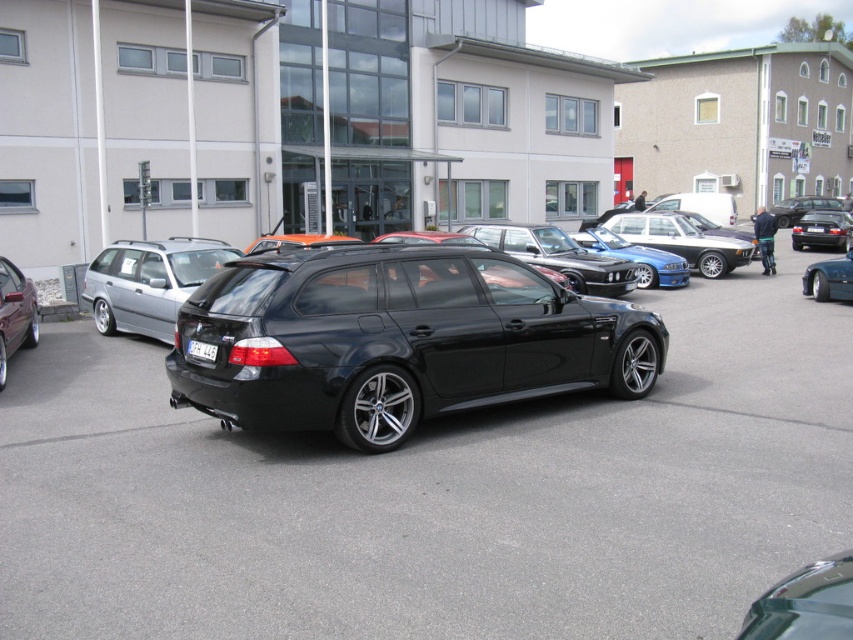
You are a parking attendant and need to direct a driver to park their car. You see the silver metallic station wagon at left and the white plastic license plate at center. Which object is positioned more to the east?

The silver metallic station wagon at left is positioned more to the east because it is to the left of the white plastic license plate at center, and in the scene, left typically corresponds to the east direction.